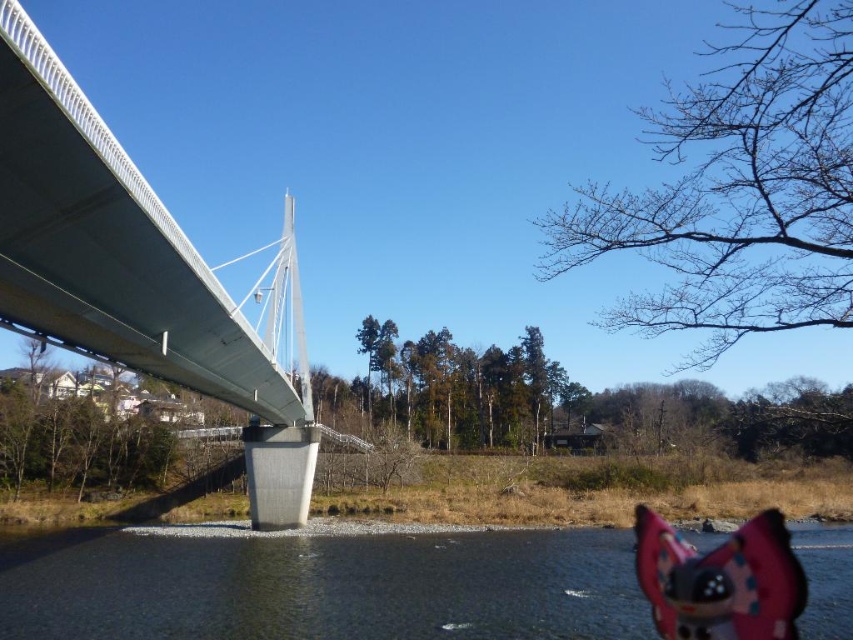
Is clear water at lower right positioned behind silver metallic suspension bridge at left?

Yes, it is behind silver metallic suspension bridge at left.

Is point (468, 564) farther from camera compared to point (76, 192)?

Yes, it is.

Does point (828, 625) come behind point (107, 237)?

Yes, it is behind point (107, 237).

I want to click on clear water at lower right, so click(323, 586).